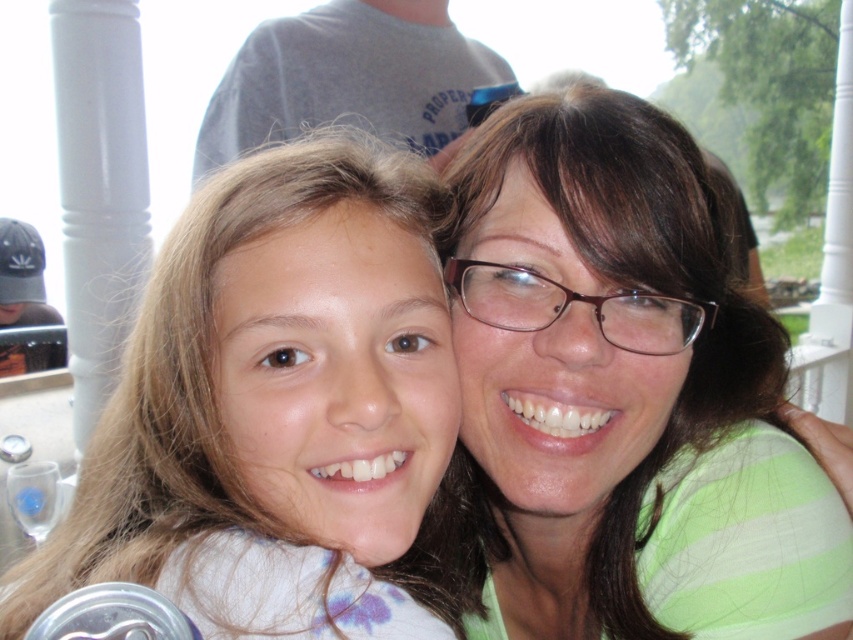
Is light brown hair at center wider than gray t-shirt at upper center?

No.

Is point (329, 250) positioned behind point (364, 67)?

That is False.

Who is more forward, (1, 618) or (201, 138)?

Point (1, 618) is more forward.

The image size is (853, 640). Identify the location of light brown hair at center. (277, 408).

Consider the image. Does matte green shirt at center appear on the left side of gray t-shirt at upper center?

In fact, matte green shirt at center is to the right of gray t-shirt at upper center.

Who is lower down, matte green shirt at center or gray t-shirt at upper center?

matte green shirt at center is lower down.

Is point (590, 557) closer to viewer compared to point (235, 134)?

Yes, it is in front of point (235, 134).

Where is `matte green shirt at center`? This screenshot has width=853, height=640. matte green shirt at center is located at coordinates (624, 390).

Which is more to the left, matte green shirt at center or light brown hair at center?

light brown hair at center

Where is `matte green shirt at center`? The width and height of the screenshot is (853, 640). matte green shirt at center is located at coordinates (624, 390).